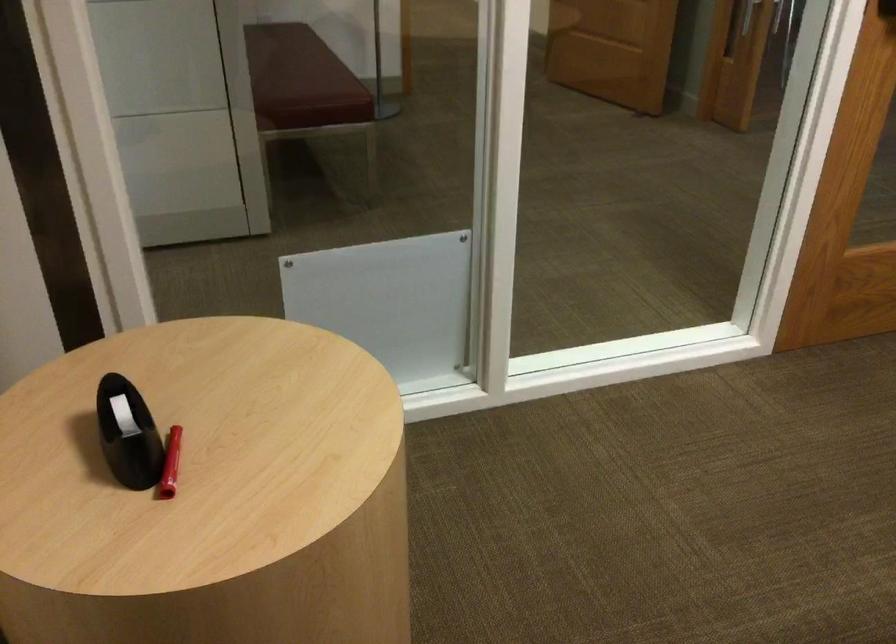
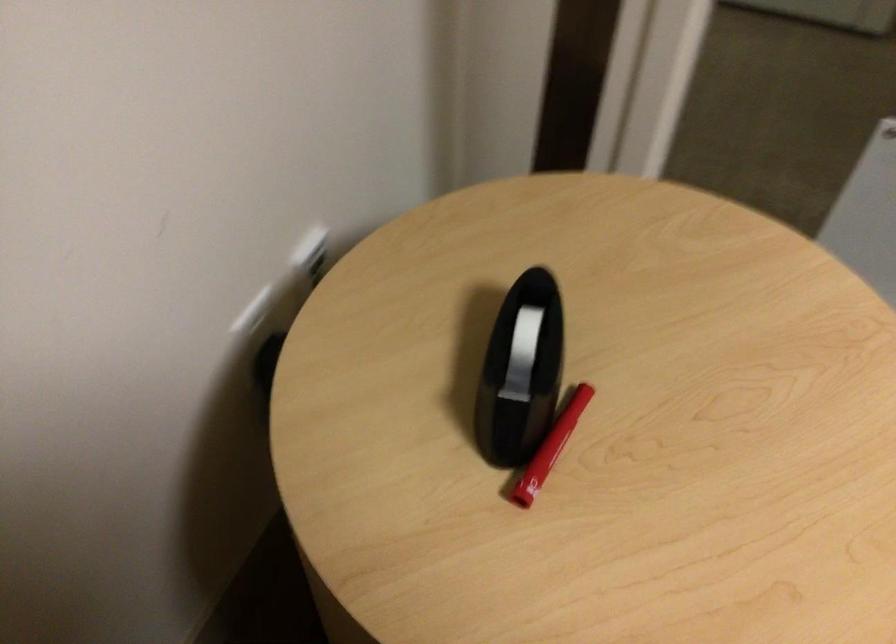
Locate, in the second image, the point that corresponds to pixel 124 424 in the first image.

(521, 354)